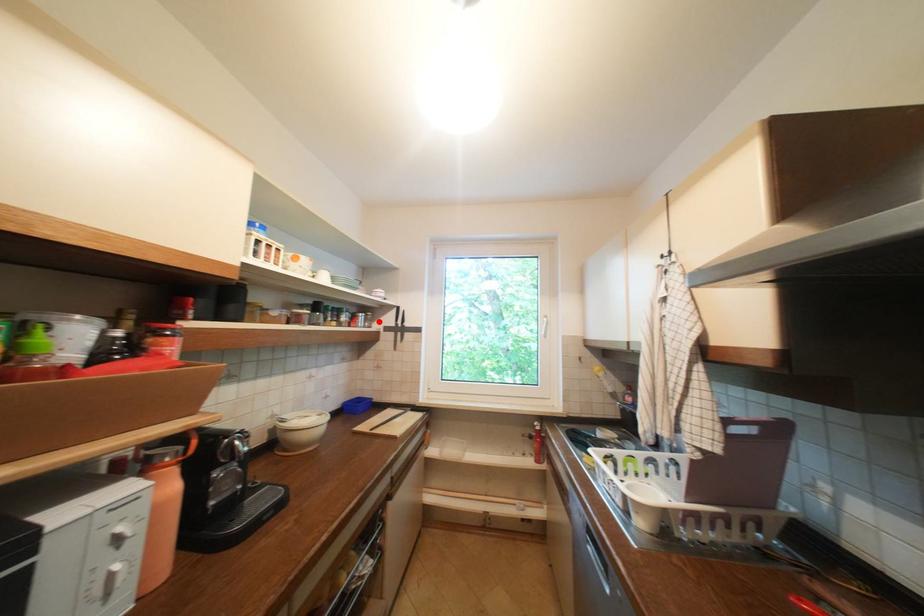
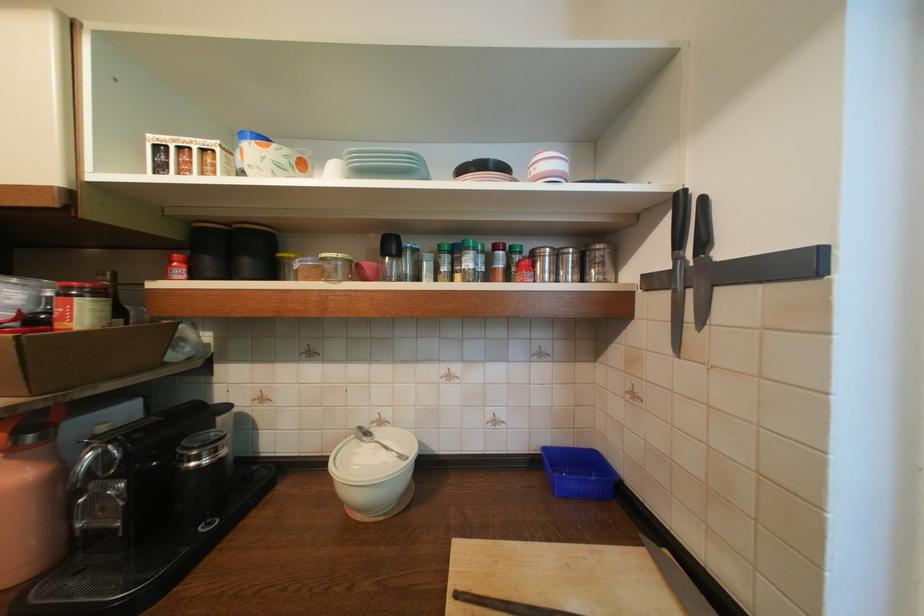
Where in the second image is the point corresponding to the highlighted location from the first image?

(611, 265)